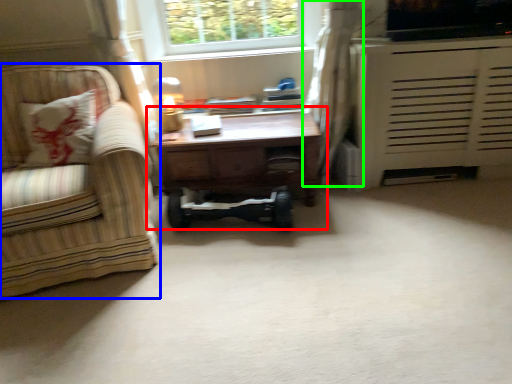
Question: Which object is positioned farthest from table (highlighted by a red box)? Select from chair (highlighted by a blue box) and curtain (highlighted by a green box).

Choices:
 (A) chair
 (B) curtain

Answer: (A)